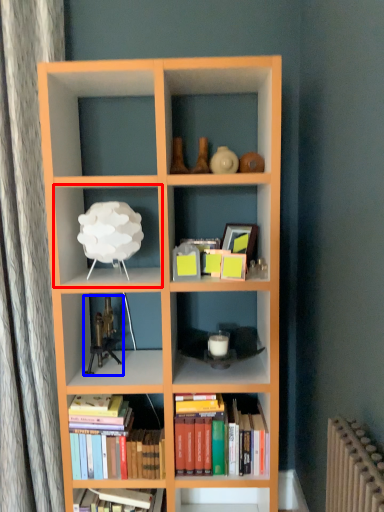
Question: Which point is closer to the camera, shelf (highlighted by a red box) or toy (highlighted by a blue box)?

Choices:
 (A) shelf
 (B) toy

Answer: (A)